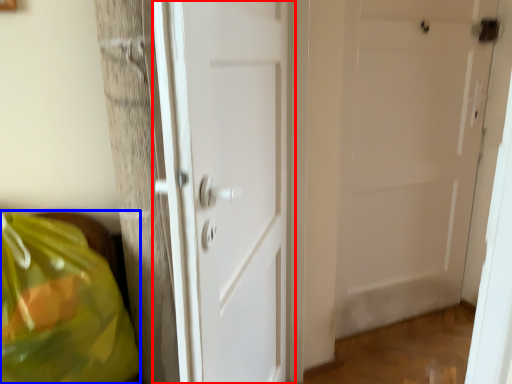
Question: Which of the following is the closest to the observer, door (highlighted by a red box) or grocery bag (highlighted by a blue box)?

Choices:
 (A) door
 (B) grocery bag

Answer: (A)